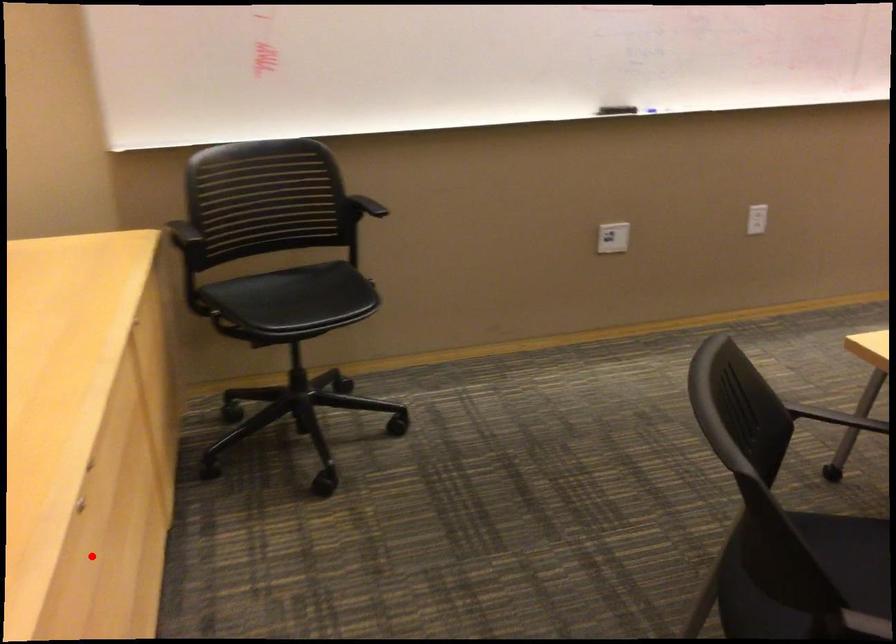
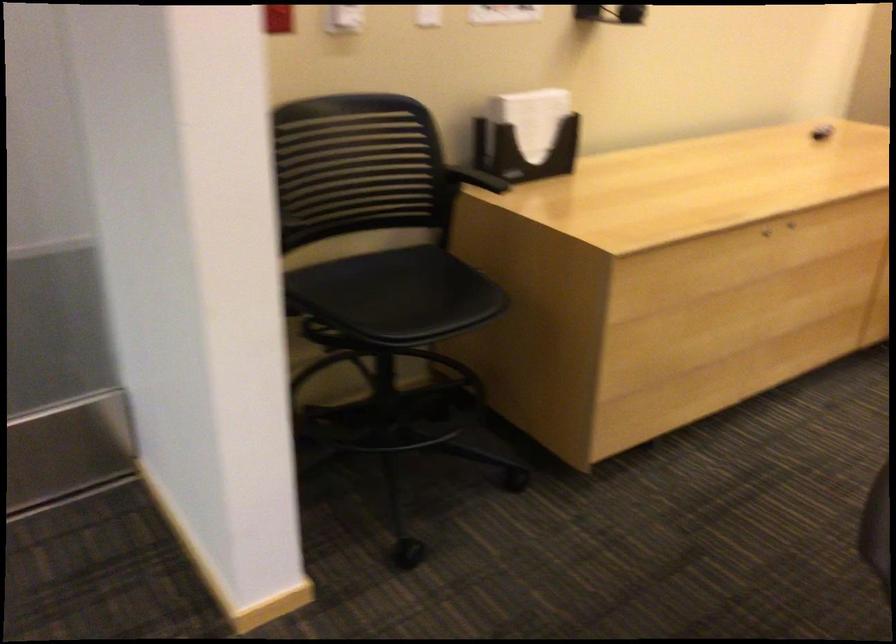
The point at the highlighted location is marked in the first image. Where is the corresponding point in the second image?

(765, 232)